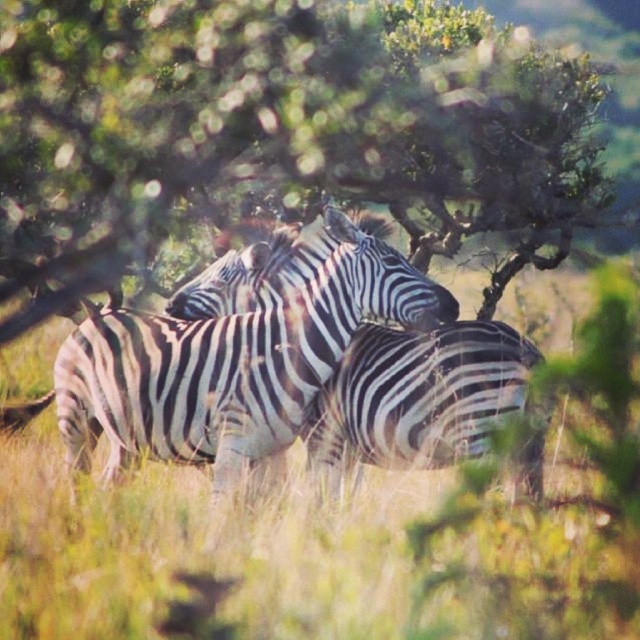
Is green grass at center to the right of black and white striped zebra at center from the viewer's perspective?

No, green grass at center is not to the right of black and white striped zebra at center.

How far apart are green grass at center and black and white striped zebra at center?

3.69 feet

What are the coordinates of `green grass at center` in the screenshot? It's located at (330, 541).

Identify the location of green grass at center. (330, 541).

Is green leafy tree at center taller than green grass at center?

Incorrect, green leafy tree at center's height is not larger of green grass at center's.

Does green leafy tree at center have a larger size compared to green grass at center?

No.

Between point (483, 177) and point (564, 611), which one is positioned behind?

Point (483, 177)

At what (x,y) coordinates should I click in order to perform the action: click on green leafy tree at center. Please return your answer as a coordinate pair (x, y). This screenshot has width=640, height=640. Looking at the image, I should click on (276, 125).

What do you see at coordinates (276, 125) in the screenshot? I see `green leafy tree at center` at bounding box center [276, 125].

Between point (381, 88) and point (268, 259), which one is positioned in front?

Point (268, 259) is in front.

This screenshot has width=640, height=640. What are the coordinates of `green leafy tree at center` in the screenshot? It's located at (276, 125).